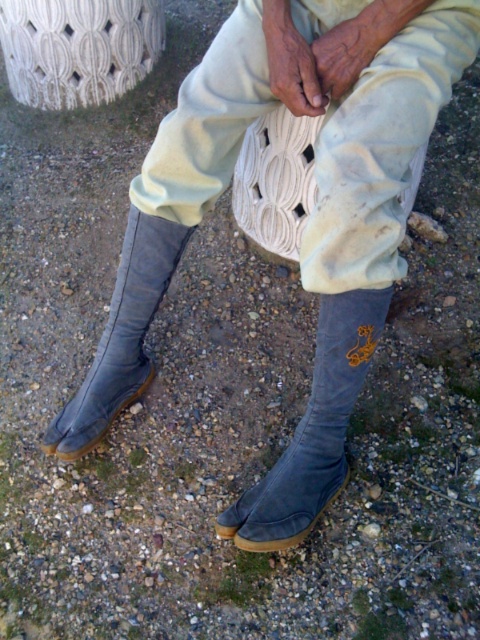
You are designing a shoe display stand and need to place both the suede gray tabi at center and the gray suede tabi at lower left side by side. Which one requires a wider space for placement?

The suede gray tabi at center requires a wider space for placement since it might be wider than the gray suede tabi at lower left according to the description.

You are standing 1.24 meters away from the suede gray tabi at center. If you want to reach them, how many steps would you need to take? Assume each step covers 0.75 meters.

Since you are 1.24 meters away from the suede gray tabi at center and each step covers 0.75 meters, you would need to take 2 steps to reach them. The first step would cover 0.75 meters, and the second step would cover the remaining distance.